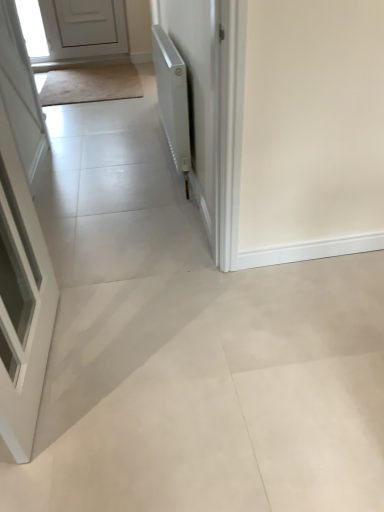
Question: Is beige carpet at upper left a part of white matte door at upper left, arranged as the second door when viewed from the front?

Choices:
 (A) no
 (B) yes

Answer: (A)

Question: Considering the relative positions of white matte door at upper left, the first door from the left, and beige carpet at upper left in the image provided, is white matte door at upper left, the first door from the left, to the left of beige carpet at upper left from the viewer's perspective?

Choices:
 (A) yes
 (B) no

Answer: (A)

Question: Considering the relative sizes of white matte door at upper left, arranged as the second door when viewed from the front, and beige carpet at upper left in the image provided, is white matte door at upper left, arranged as the second door when viewed from the front, shorter than beige carpet at upper left?

Choices:
 (A) no
 (B) yes

Answer: (A)

Question: Is white matte door at upper left, placed as the first door when sorted from back to front, not within beige carpet at upper left?

Choices:
 (A) yes
 (B) no

Answer: (A)

Question: Considering the relative sizes of white matte door at upper left, the first door from the left, and beige carpet at upper left in the image provided, is white matte door at upper left, the first door from the left, wider than beige carpet at upper left?

Choices:
 (A) yes
 (B) no

Answer: (B)

Question: From a real-world perspective, is white matte door at upper left, placed as the first door when sorted from back to front, under beige carpet at upper left?

Choices:
 (A) no
 (B) yes

Answer: (A)

Question: Is beige carpet at upper left turned away from white glossy door at left, which is counted as the first door, starting from the front?

Choices:
 (A) no
 (B) yes

Answer: (A)

Question: Would you say beige carpet at upper left contains white glossy door at left, positioned as the second door in top-to-bottom order?

Choices:
 (A) yes
 (B) no

Answer: (B)

Question: Does beige carpet at upper left have a larger size compared to white glossy door at left, positioned as the second door in top-to-bottom order?

Choices:
 (A) no
 (B) yes

Answer: (A)

Question: From the image's perspective, is beige carpet at upper left over white glossy door at left, positioned as the second door in top-to-bottom order?

Choices:
 (A) no
 (B) yes

Answer: (B)

Question: From the image's perspective, does beige carpet at upper left appear lower than white glossy door at left, placed as the first door when sorted from bottom to top?

Choices:
 (A) no
 (B) yes

Answer: (A)

Question: Does beige carpet at upper left turn towards white glossy door at left, positioned as the second door in top-to-bottom order?

Choices:
 (A) no
 (B) yes

Answer: (A)

Question: From the image's perspective, is white matte radiator at upper right beneath white matte door at upper left, arranged as the second door when viewed from the front?

Choices:
 (A) yes
 (B) no

Answer: (A)